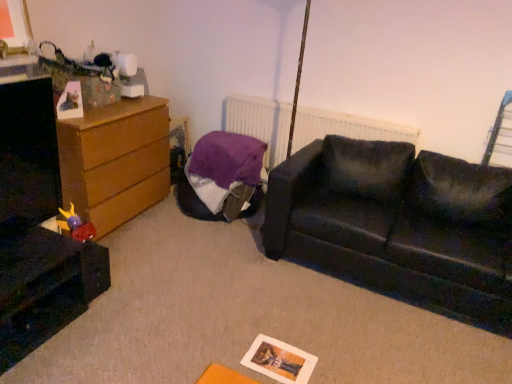
Question: Are wooden chest of drawers at left and purple fabric bean bag at center far apart?

Choices:
 (A) no
 (B) yes

Answer: (A)

Question: Considering the relative positions of wooden chest of drawers at left and purple fabric bean bag at center in the image provided, is wooden chest of drawers at left to the left of purple fabric bean bag at center from the viewer's perspective?

Choices:
 (A) no
 (B) yes

Answer: (B)

Question: From the image's perspective, is wooden chest of drawers at left below purple fabric bean bag at center?

Choices:
 (A) yes
 (B) no

Answer: (B)

Question: Is wooden chest of drawers at left oriented towards purple fabric bean bag at center?

Choices:
 (A) no
 (B) yes

Answer: (B)

Question: Considering the relative sizes of wooden chest of drawers at left and purple fabric bean bag at center in the image provided, is wooden chest of drawers at left wider than purple fabric bean bag at center?

Choices:
 (A) no
 (B) yes

Answer: (A)

Question: Is white matte radiator at upper center taller or shorter than black leather couch at center?

Choices:
 (A) short
 (B) tall

Answer: (A)

Question: From a real-world perspective, is white matte radiator at upper center positioned above or below black leather couch at center?

Choices:
 (A) below
 (B) above

Answer: (B)

Question: From the image's perspective, is white matte radiator at upper center located above or below black leather couch at center?

Choices:
 (A) above
 (B) below

Answer: (A)

Question: Is white matte radiator at upper center in front of or behind black leather couch at center in the image?

Choices:
 (A) front
 (B) behind

Answer: (B)

Question: Is plush purple toy at lower left to the left or to the right of wooden chest of drawers at left in the image?

Choices:
 (A) right
 (B) left

Answer: (A)

Question: From a real-world perspective, is plush purple toy at lower left above or below wooden chest of drawers at left?

Choices:
 (A) above
 (B) below

Answer: (B)

Question: Based on their sizes in the image, would you say plush purple toy at lower left is bigger or smaller than wooden chest of drawers at left?

Choices:
 (A) small
 (B) big

Answer: (A)

Question: Is plush purple toy at lower left in front of or behind wooden chest of drawers at left in the image?

Choices:
 (A) behind
 (B) front

Answer: (B)

Question: Is metallic silver swivel chair at upper right situated inside white matte radiator at upper center or outside?

Choices:
 (A) inside
 (B) outside

Answer: (B)

Question: Based on their positions, is metallic silver swivel chair at upper right located to the left or right of white matte radiator at upper center?

Choices:
 (A) left
 (B) right

Answer: (B)